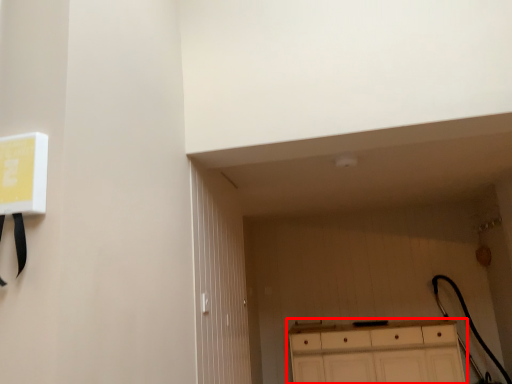
Question: From the image's perspective, where is cabinetry (annotated by the red box) located relative to door?

Choices:
 (A) below
 (B) above

Answer: (A)